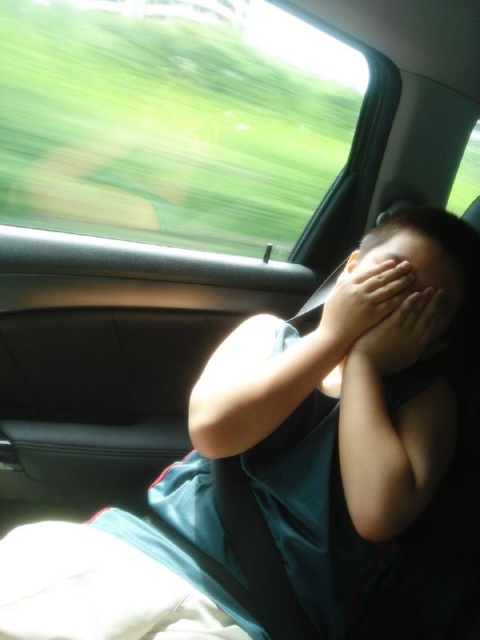
Question: Does smooth skin head at center have a larger size compared to matte skin face at center?

Choices:
 (A) yes
 (B) no

Answer: (A)

Question: Estimate the real-world distances between objects in this image. Which object is closer to the matte skin hand at center?

Choices:
 (A) transparent glass car window at upper left
 (B) matte skin face at center

Answer: (B)

Question: Is smooth skin head at center closer to camera compared to smooth skin hand at center?

Choices:
 (A) yes
 (B) no

Answer: (B)

Question: Which object is positioned farthest from the transparent glass car window at upper left?

Choices:
 (A) matte skin face at center
 (B) smooth skin hand at center
 (C) smooth skin head at center

Answer: (B)

Question: Where is transparent glass car window at upper left located in relation to matte skin hand at center in the image?

Choices:
 (A) above
 (B) below

Answer: (A)

Question: Estimate the real-world distances between objects in this image. Which object is closer to the smooth skin head at center?

Choices:
 (A) transparent glass car window at upper left
 (B) matte skin face at center

Answer: (B)